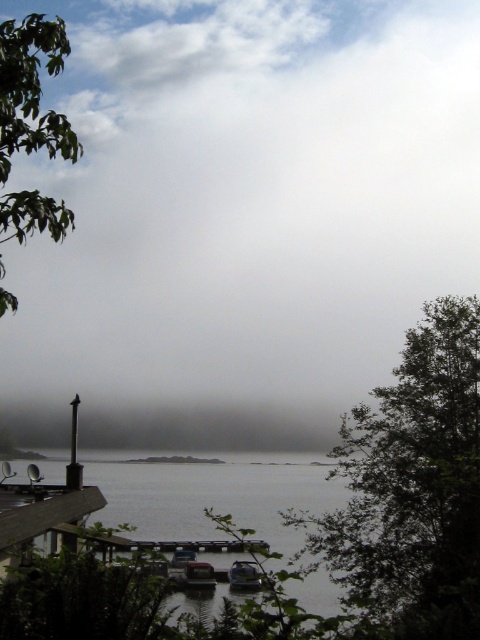
Question: Does green leafy tree at right have a smaller size compared to metallic gray boat at lower center?

Choices:
 (A) no
 (B) yes

Answer: (A)

Question: Is gray matte water at center smaller than metallic gray boat at center?

Choices:
 (A) no
 (B) yes

Answer: (A)

Question: Which point is closer to the camera taking this photo?

Choices:
 (A) (192, 586)
 (B) (267, 44)
 (C) (49, 148)

Answer: (C)

Question: Can you confirm if green leafy tree at right is thinner than metallic gray boat at lower center?

Choices:
 (A) yes
 (B) no

Answer: (B)

Question: Which point appears farthest from the camera in this image?

Choices:
 (A) (254, 579)
 (B) (249, 300)

Answer: (B)

Question: Which point is closer to the camera?

Choices:
 (A) (172, 570)
 (B) (463, 180)
 (C) (32, 500)

Answer: (C)